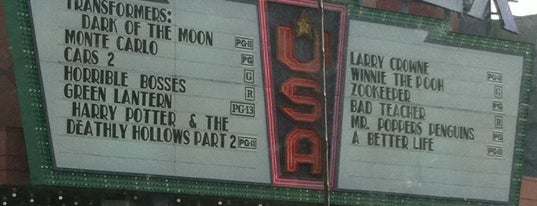
Where is `lights`? The width and height of the screenshot is (537, 206). lights is located at coordinates (41, 142).